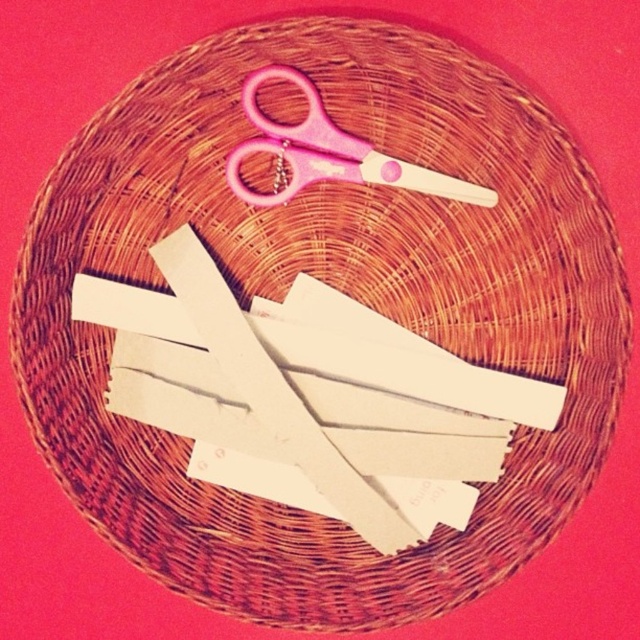
You are organizing a craft station and need to place the white paper at center and the pink plastic scissors at upper center. According to the image, which object is positioned to the left of the other?

The white paper at center is to the left of the pink plastic scissors at upper center.

You are standing 6 feet away from the camera. You want to pick up the white paper at center. Can you reach it without moving closer?

The white paper at center is 4.00 feet from the camera. Since you are 6 feet away from the camera, you are 2 feet behind the white paper at center. Therefore, you cannot reach it without moving closer.

You are standing in front of the basket and notice a point at coordinates (x=307, y=385). What object is located at that point?

The point at coordinates (x=307, y=385) corresponds to the white paper at center.